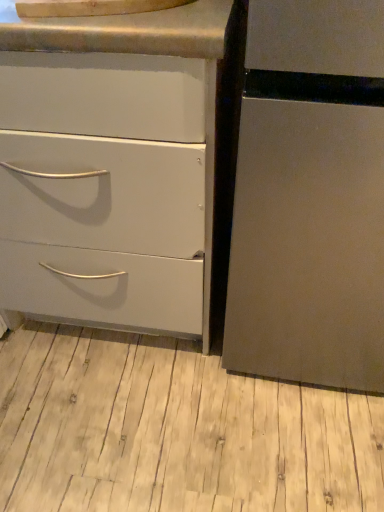
Find the location of a particular element. The height and width of the screenshot is (512, 384). vacant area that is in front of matte white drawer at left is located at coordinates (141, 425).